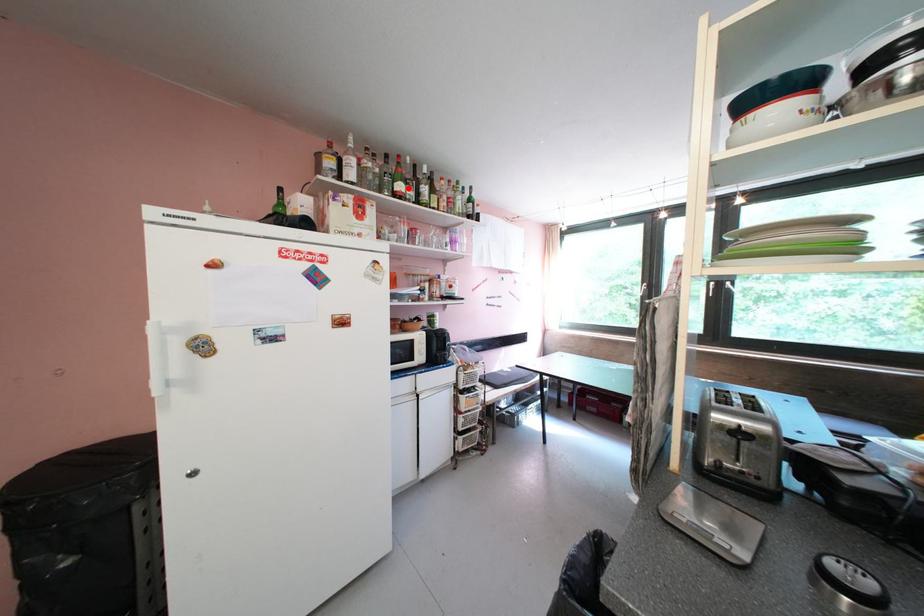
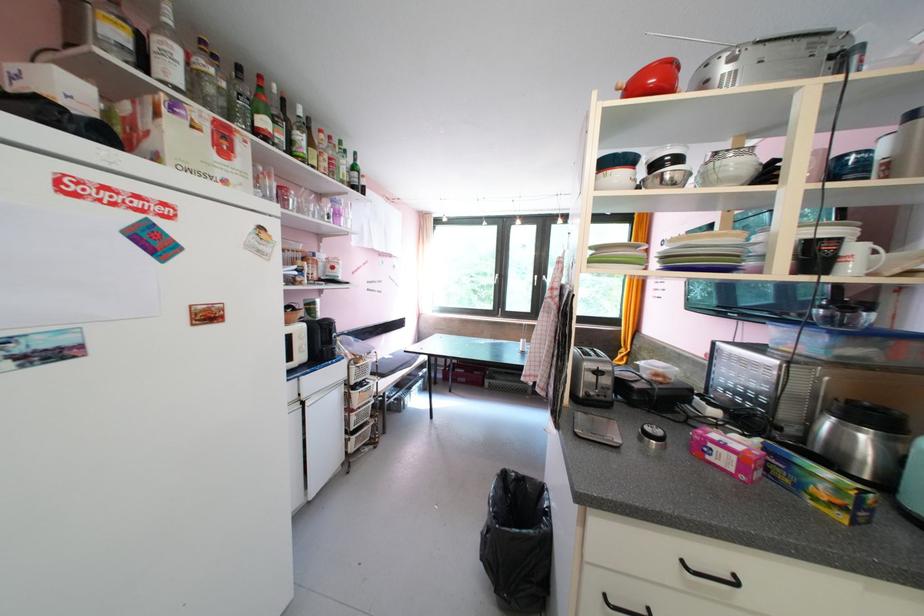
Question: I am providing you with two images of the same scene from different viewpoints. A red point is marked on the first image. At the location where the point appears in image 1, is it still visible in image 2?

Choices:
 (A) Yes
 (B) No

Answer: (A)